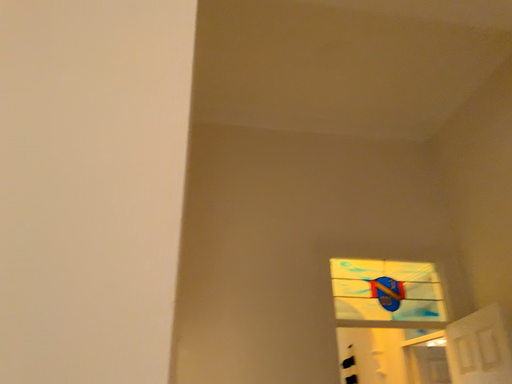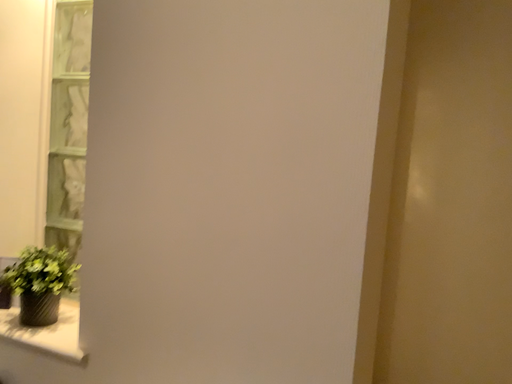
Question: Which way did the camera rotate in the video?

Choices:
 (A) rotated upward
 (B) rotated downward

Answer: (B)